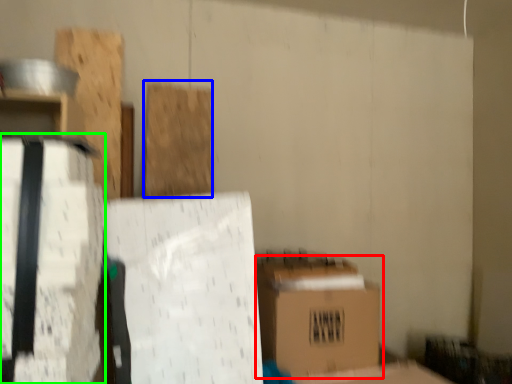
Question: Based on their relative distances, which object is nearer to box (highlighted by a red box)? Choose from wood (highlighted by a blue box) and cardboard box (highlighted by a green box).

Choices:
 (A) wood
 (B) cardboard box

Answer: (A)